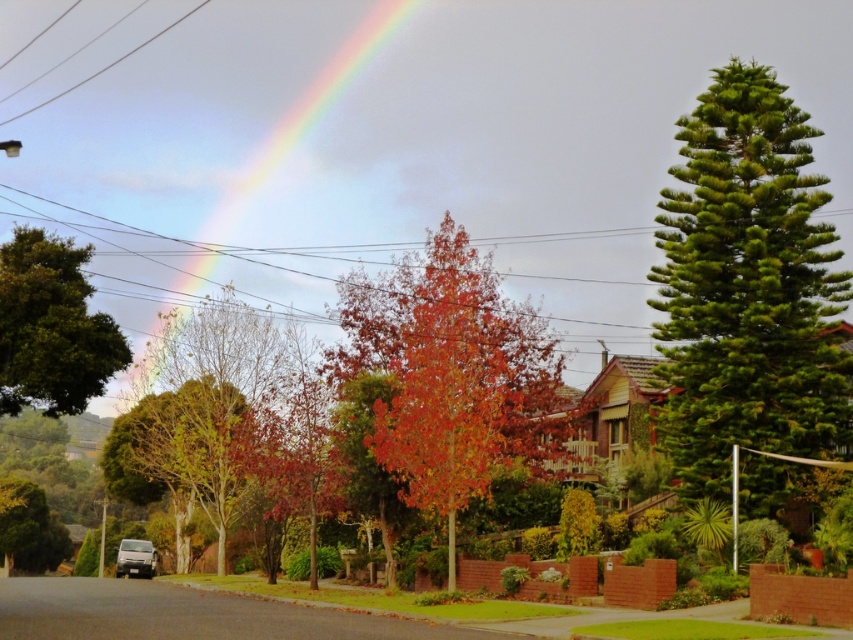
Question: Is green needle-like tree at right behind green leafy tree at left?

Choices:
 (A) no
 (B) yes

Answer: (B)

Question: Which point is closer to the camera?

Choices:
 (A) green leafy tree at left
 (B) rainbow at upper center
 (C) shiny red tree at center
 (D) orange-brown bark tree at center

Answer: (A)

Question: Estimate the real-world distances between objects in this image. Which object is farther from the orange-brown bark tree at center?

Choices:
 (A) shiny red tree at center
 (B) green leafy tree at left

Answer: (B)

Question: Does green leafy tree at left appear on the left side of orange-brown bark tree at center?

Choices:
 (A) yes
 (B) no

Answer: (B)

Question: Estimate the real-world distances between objects in this image. Which object is farther from the green leafy tree at left?

Choices:
 (A) shiny red tree at center
 (B) rainbow at upper center
 (C) green needle-like tree at right

Answer: (B)

Question: Does green needle-like tree at right appear over shiny red tree at center?

Choices:
 (A) yes
 (B) no

Answer: (A)